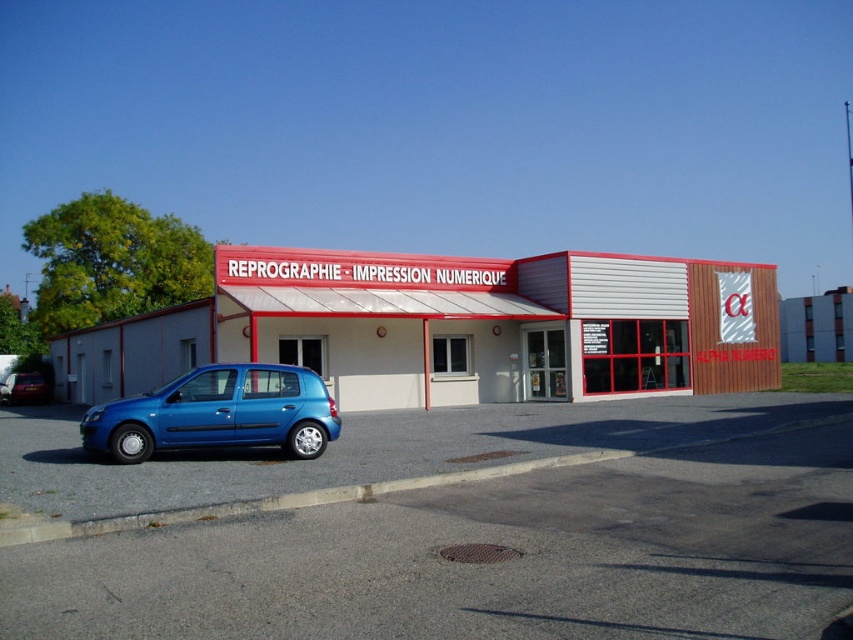
Can you confirm if gray asphalt parking lot at lower left is thinner than blue metallic car at lower left?

Incorrect, gray asphalt parking lot at lower left's width is not less than blue metallic car at lower left's.

Is point (195, 618) positioned after point (38, 401)?

No, it is in front of (38, 401).

Locate an element on the screen. This screenshot has width=853, height=640. gray asphalt parking lot at lower left is located at coordinates (445, 528).

Which is more to the right, gray asphalt parking lot at lower left or blue metallic hatchback at lower left?

gray asphalt parking lot at lower left is more to the right.

Does gray asphalt parking lot at lower left come in front of blue metallic hatchback at lower left?

Yes, gray asphalt parking lot at lower left is in front of blue metallic hatchback at lower left.

Is point (184, 579) behind point (257, 392)?

No, (184, 579) is closer to viewer.

Identify the location of gray asphalt parking lot at lower left. (445, 528).

Who is shorter, blue metallic hatchback at lower left or blue metallic car at lower left?

With less height is blue metallic car at lower left.

Who is positioned more to the left, blue metallic hatchback at lower left or blue metallic car at lower left?

blue metallic car at lower left is more to the left.

Identify the location of blue metallic hatchback at lower left. The width and height of the screenshot is (853, 640). (218, 413).